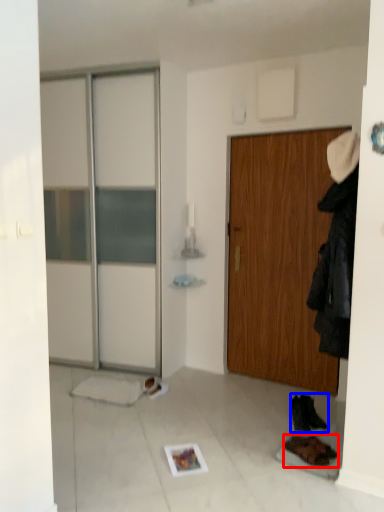
Question: Which of the following is the closest to the observer, footwear (highlighted by a red box) or footwear (highlighted by a blue box)?

Choices:
 (A) footwear
 (B) footwear

Answer: (A)